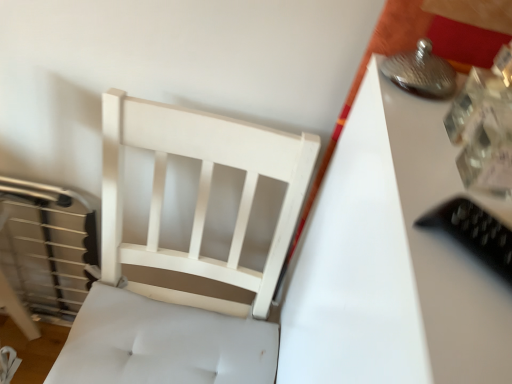
Find the location of a particular element. The width and height of the screenshot is (512, 384). free spot behind black plastic remote at right is located at coordinates (435, 141).